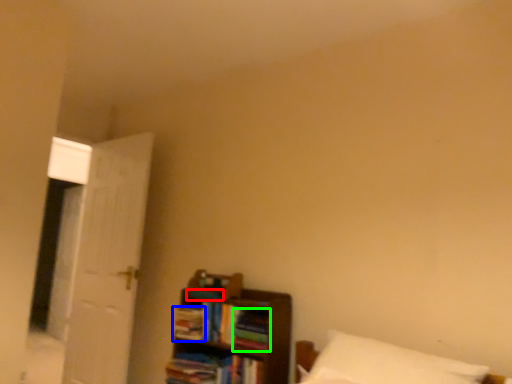
Question: Estimate the real-world distances between objects in this image. Which object is farther from book (highlighted by a red box), book (highlighted by a blue box) or book (highlighted by a green box)?

Choices:
 (A) book
 (B) book

Answer: (B)